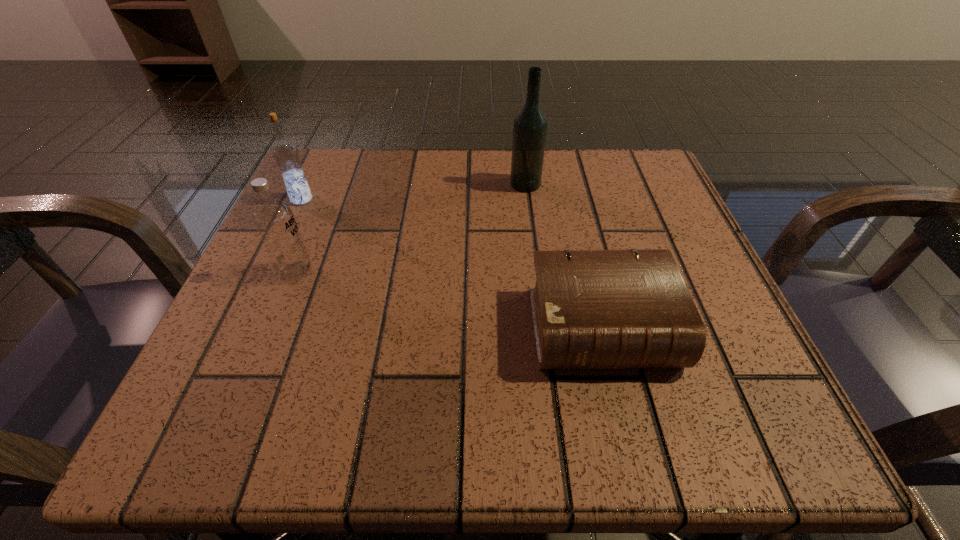
Identify which object is the third closest to the second nearest object. Please provide its 2D coordinates. Your answer should be formatted as a tuple, i.e. [(x, y)], where the tuple contains the x and y coordinates of a point satisfying the conditions above.

[(530, 125)]

Choose which object is the third nearest neighbor to the nearest vodka. Please provide its 2D coordinates. Your answer should be formatted as a tuple, i.e. [(x, y)], where the tuple contains the x and y coordinates of a point satisfying the conditions above.

[(530, 125)]

Locate which vodka ranks third in proximity to the shortest object. Please provide its 2D coordinates. Your answer should be formatted as a tuple, i.e. [(x, y)], where the tuple contains the x and y coordinates of a point satisfying the conditions above.

[(286, 155)]

The height and width of the screenshot is (540, 960). I want to click on vodka that is the second closest to the tallest object, so click(x=286, y=155).